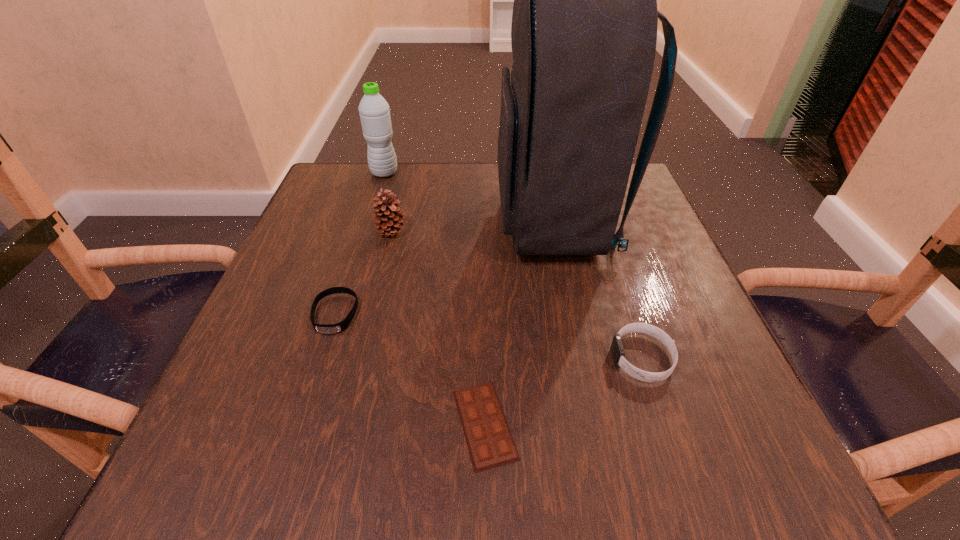
Locate an element on the screen. The image size is (960, 540). vacant region at the right edge of the desktop is located at coordinates (688, 324).

Locate an element on the screen. vacant region at the far left corner is located at coordinates (349, 165).

The height and width of the screenshot is (540, 960). Identify the location of free space at the near left corner of the desktop. (310, 455).

Where is `vacant point at the near right corner`? vacant point at the near right corner is located at coordinates (716, 429).

Find the location of `free space between the chocolate bar and the second shortest object`. free space between the chocolate bar and the second shortest object is located at coordinates (410, 369).

The height and width of the screenshot is (540, 960). Identify the location of empty space that is in between the third tallest object and the tallest object. (x=473, y=227).

Where is `vacant space in between the backpack and the pinecone`? The height and width of the screenshot is (540, 960). vacant space in between the backpack and the pinecone is located at coordinates (473, 227).

Identify the location of blank region between the tallest object and the left wristband. The image size is (960, 540). (445, 268).

This screenshot has height=540, width=960. I want to click on empty space between the left wristband and the farthest object, so click(360, 244).

The image size is (960, 540). Find the location of `free space between the shortest object and the backpack`. free space between the shortest object and the backpack is located at coordinates (520, 323).